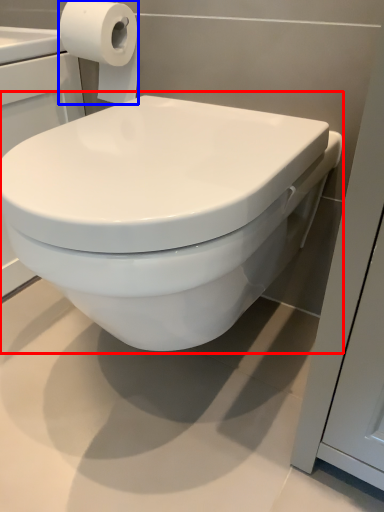
Question: Which point is further to the camera, toilet (highlighted by a red box) or toilet paper (highlighted by a blue box)?

Choices:
 (A) toilet
 (B) toilet paper

Answer: (B)